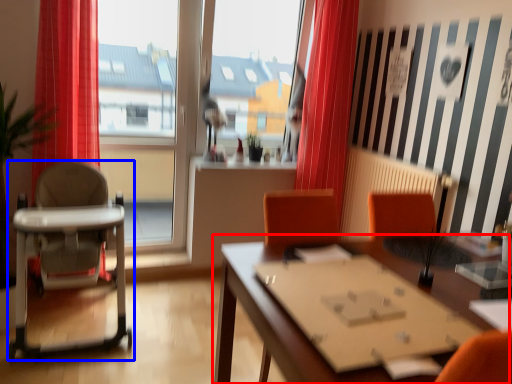
Question: Which of the following is the farthest to the observer, table (highlighted by a red box) or chair (highlighted by a blue box)?

Choices:
 (A) table
 (B) chair

Answer: (B)